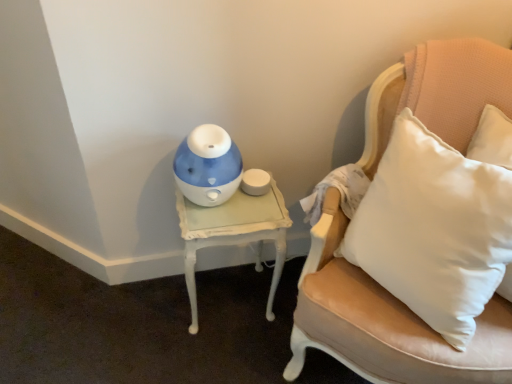
Locate an element on the screen. free space in front of white painted wood table at left is located at coordinates (216, 355).